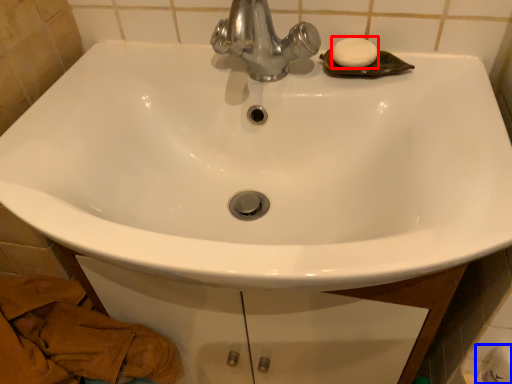
Question: Which point is further to the camera, soap (highlighted by a red box) or toilet paper (highlighted by a blue box)?

Choices:
 (A) soap
 (B) toilet paper

Answer: (A)